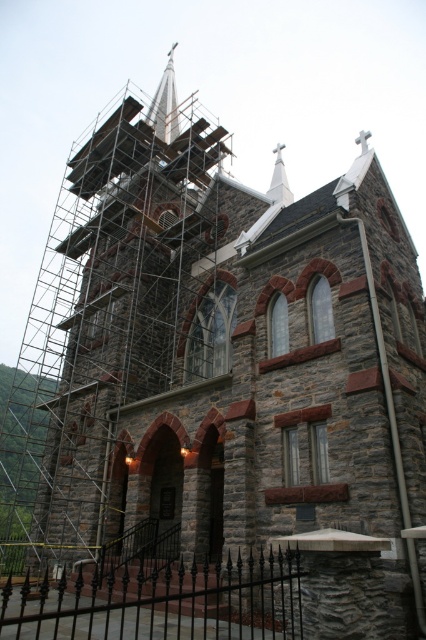
Is silver metallic spire at upper center bigger than white smooth steeple at upper center?

Indeed, silver metallic spire at upper center has a larger size compared to white smooth steeple at upper center.

From the picture: Which of these two, silver metallic spire at upper center or white smooth steeple at upper center, stands taller?

silver metallic spire at upper center is taller.

Between point (164, 90) and point (279, 176), which one is positioned in front?

Positioned in front is point (279, 176).

The height and width of the screenshot is (640, 426). In order to click on silver metallic spire at upper center in this screenshot , I will do (x=164, y=104).